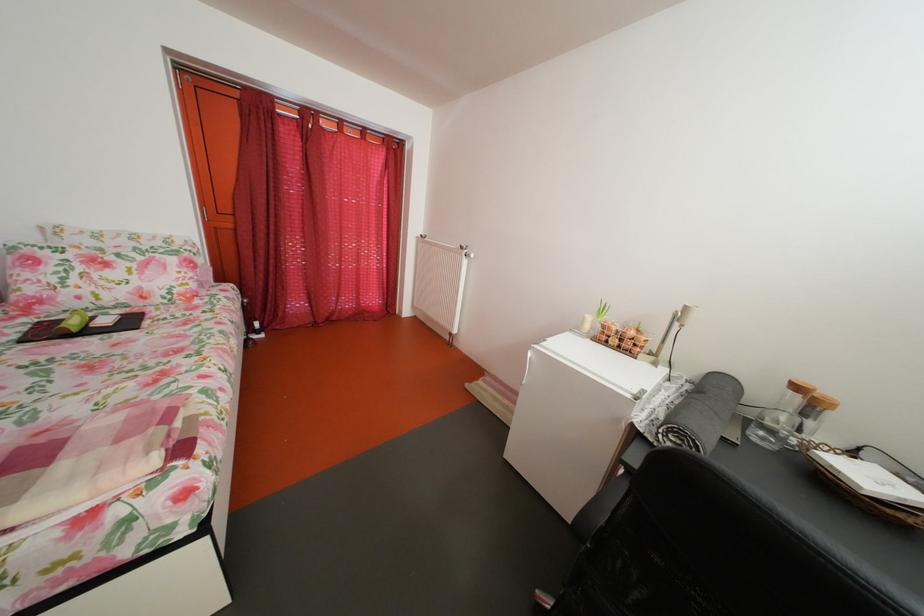
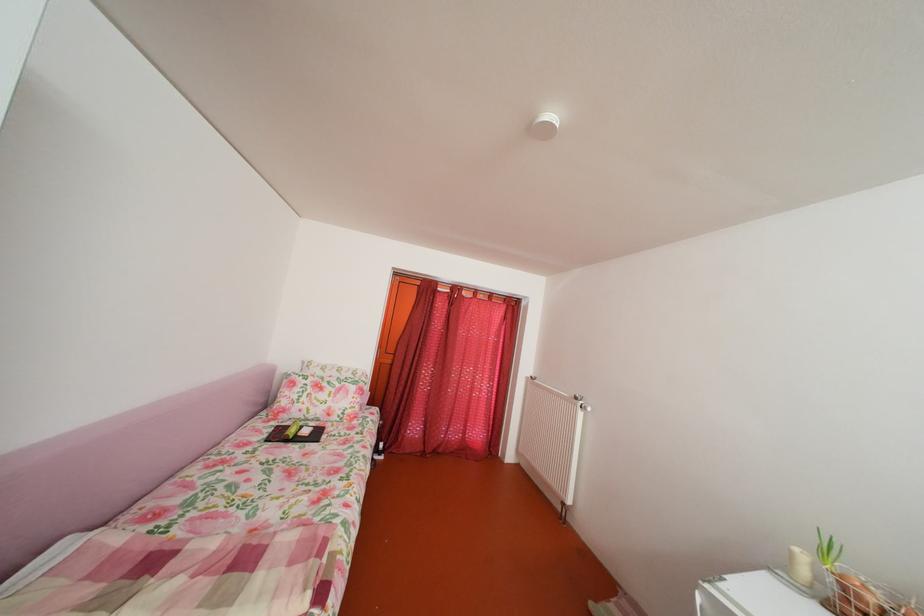
The point at [626,334] is marked in the first image. Where is the corresponding point in the second image?

(882, 607)